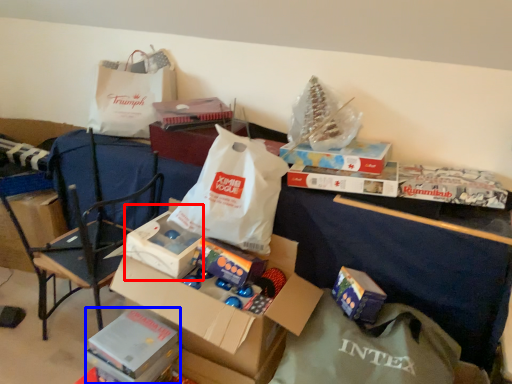
Question: Which object is further to the camera taking this photo, storage box (highlighted by a red box) or storage box (highlighted by a blue box)?

Choices:
 (A) storage box
 (B) storage box

Answer: (A)